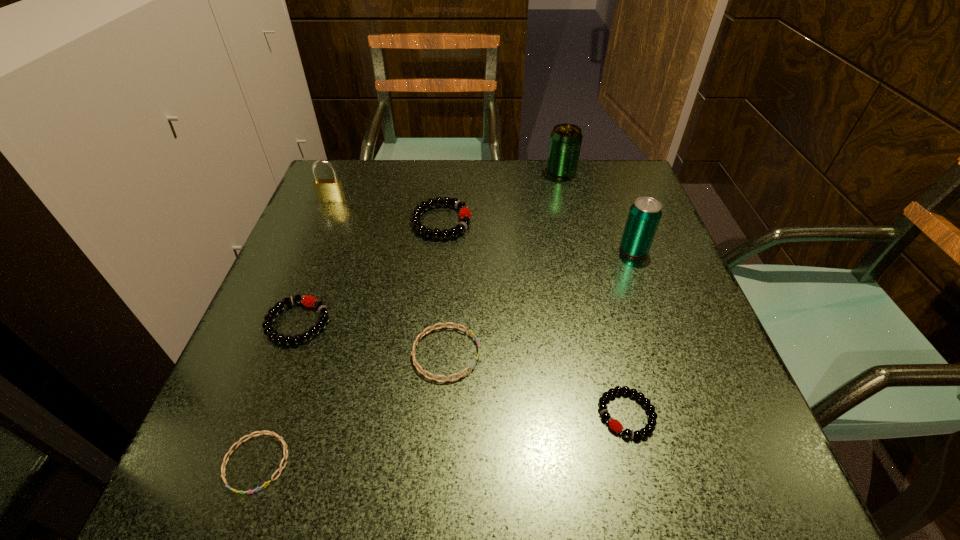
You are a GUI agent. You are given a task and a screenshot of the screen. Output one action in this format:
    pyautogui.click(x=<x>, y=<y>)
    Task: Click on the object that is positioned at the far right corner
    
    Given the screenshot: What is the action you would take?
    pyautogui.click(x=565, y=143)

Find the location of a particular element. This screenshot has height=540, width=960. object that is at the near right corner is located at coordinates (614, 424).

This screenshot has height=540, width=960. In the image, there is a desktop. Identify the location of vacant space at the far edge. (534, 206).

This screenshot has width=960, height=540. I want to click on vacant space at the near edge of the desktop, so click(586, 451).

Find the location of a particular element. The width and height of the screenshot is (960, 540). blank space at the left edge is located at coordinates (350, 293).

What are the coordinates of `vacant area at the right edge` in the screenshot? It's located at (665, 426).

In the image, there is a desktop. Identify the location of vacant area at the far left corner. (329, 207).

You are a GUI agent. You are given a task and a screenshot of the screen. Output one action in this format:
    pyautogui.click(x=<x>, y=<y>)
    Task: Click on the free space at the far right corner of the desktop
    Image resolution: width=960 pixels, height=540 pixels.
    Given the screenshot: What is the action you would take?
    pyautogui.click(x=624, y=172)

This screenshot has height=540, width=960. Find the location of `unoccupied position between the right blue bracelet and the right beer can`. unoccupied position between the right blue bracelet and the right beer can is located at coordinates (540, 302).

You are a GUI agent. You are given a task and a screenshot of the screen. Output one action in this format:
    pyautogui.click(x=<x>, y=<y>)
    Task: Click on the free space between the second farthest object and the farthest object
    The width and height of the screenshot is (960, 540).
    Given the screenshot: What is the action you would take?
    pyautogui.click(x=446, y=186)